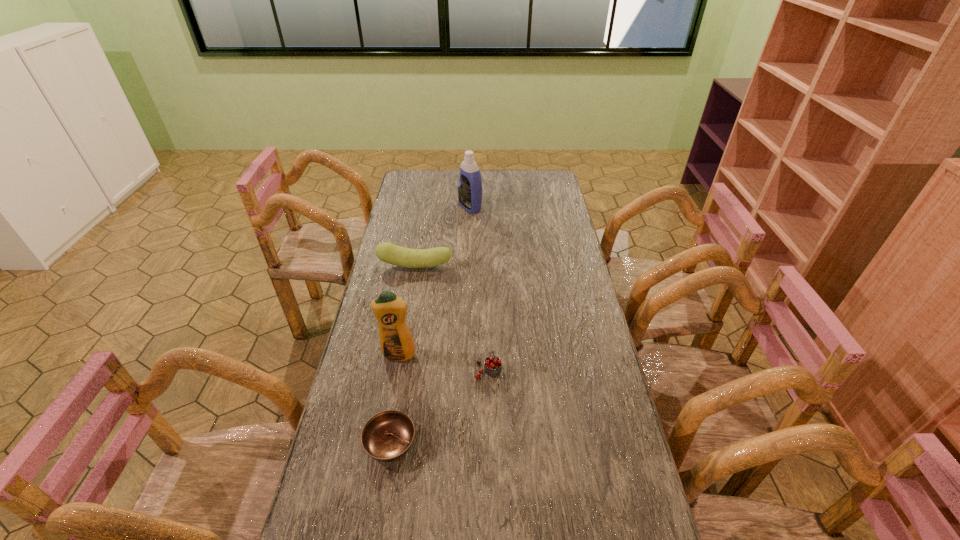
Where is `free spot located on the right of the second farthest object`? free spot located on the right of the second farthest object is located at coordinates (484, 266).

At what (x,y) coordinates should I click in order to perform the action: click on free space located on the handle side of the fourth tallest object. Please return your answer as a coordinate pair (x, y). The height and width of the screenshot is (540, 960). Looking at the image, I should click on (488, 332).

At what (x,y) coordinates should I click in order to perform the action: click on vacant space positioned 0.140m on the handle side of the fourth tallest object. Please return your answer as a coordinate pair (x, y). Looking at the image, I should click on (488, 325).

The height and width of the screenshot is (540, 960). Find the location of `free space located 0.060m on the handle side of the fourth tallest object`. free space located 0.060m on the handle side of the fourth tallest object is located at coordinates (488, 343).

Locate an element on the screen. vacant space situated on the back of the soup bowl is located at coordinates 400,383.

In order to click on detergent that is at the left edge in this screenshot , I will do `click(396, 342)`.

Identify the location of cucumber at the left edge. (387, 252).

Identify the location of soup bowl located in the left edge section of the desktop. This screenshot has height=540, width=960. (387, 436).

You are a GUI agent. You are given a task and a screenshot of the screen. Output one action in this format:
    pyautogui.click(x=<x>, y=<y>)
    Task: Click on the vacant space at the far edge
    The height and width of the screenshot is (540, 960).
    Given the screenshot: What is the action you would take?
    pyautogui.click(x=443, y=180)

The width and height of the screenshot is (960, 540). In the image, there is a desktop. Identify the location of vacant region at the left edge. point(404,221).